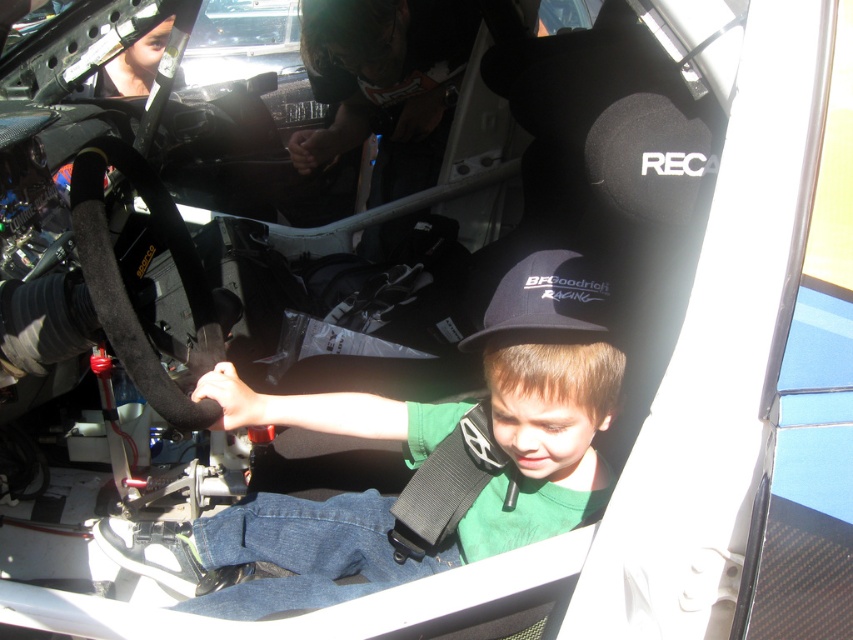
Is green fabric shirt at center positioned before black fabric baseball cap at center?

No, green fabric shirt at center is behind black fabric baseball cap at center.

Can you confirm if green fabric shirt at center is shorter than black fabric baseball cap at center?

Incorrect, green fabric shirt at center's height does not fall short of black fabric baseball cap at center's.

The width and height of the screenshot is (853, 640). What do you see at coordinates (397, 497) in the screenshot?
I see `green fabric shirt at center` at bounding box center [397, 497].

Locate an element on the screen. green fabric shirt at center is located at coordinates (397, 497).